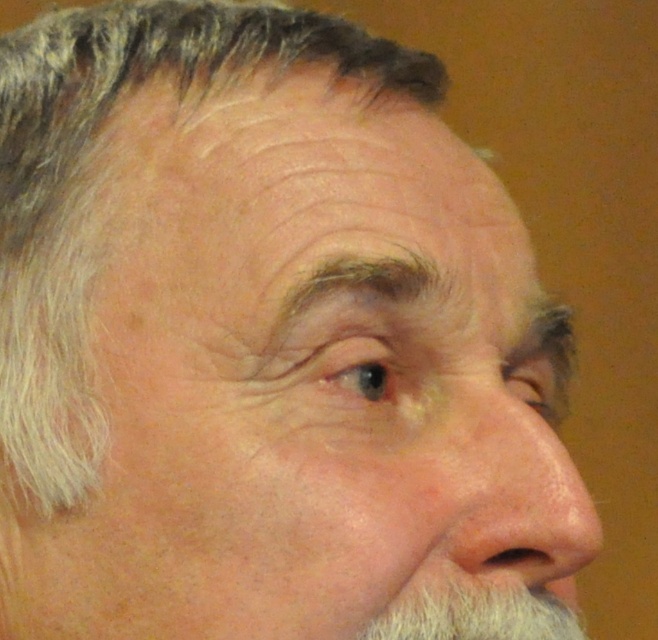
You are a dermatologist examining a patient. The patient has a dry skin nose at center. Where exactly is the dry skin nose located on the patient? Please provide the coordinates.

The dry skin nose at center is located at coordinates point (x=526, y=499).

You are a photographer adjusting lighting for a portrait. You need to ensure the dry skin nose at center and white fuzzy beard at lower right are both clearly visible. Based on their positions, which object should you focus on first to avoid shadows obscuring them?

The dry skin nose at center should be focused on first because it is positioned to the right of the white fuzzy beard at lower right, so adjusting the lighting to highlight the nose will also ensure the beard remains visible without shadows covering it.

In the scene shown: You are a photographer setting up a lighting setup for a portrait. You need to ensure that the gray matte hair at upper left and the white fuzzy beard at lower right are both well lit. Based on their positions, which object should you adjust the light first to avoid shadows?

The gray matte hair at upper left is above the white fuzzy beard at lower right. Therefore, you should adjust the light first for the gray matte hair at upper left to prevent its shadow from falling onto the white fuzzy beard at lower right below it.